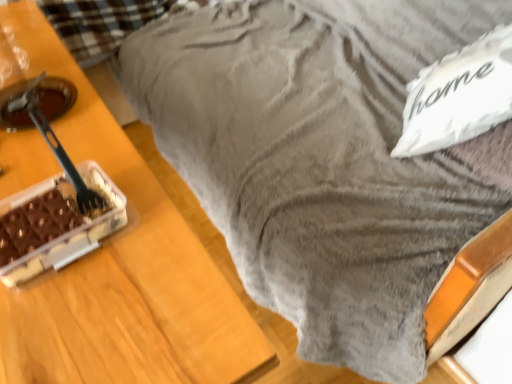
I want to click on free spot in front of chocolate matte cake at left, so click(x=79, y=321).